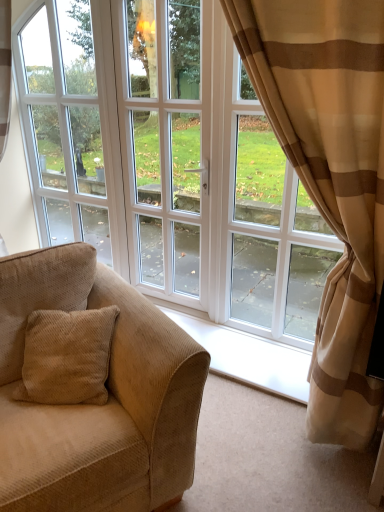
Question: Does point (261, 48) appear closer or farther from the camera than point (165, 382)?

Choices:
 (A) closer
 (B) farther

Answer: (B)

Question: Is beige striped curtain at right situated inside beige corduroy couch at left or outside?

Choices:
 (A) inside
 (B) outside

Answer: (B)

Question: Which object is positioned farthest from the beige corduroy couch at left?

Choices:
 (A) white glossy door at center
 (B) beige striped curtain at right
 (C) white glass window at center

Answer: (C)

Question: Which object is the closest to the beige corduroy couch at left?

Choices:
 (A) beige striped curtain at right
 (B) white glossy door at center
 (C) white glass window at center

Answer: (A)